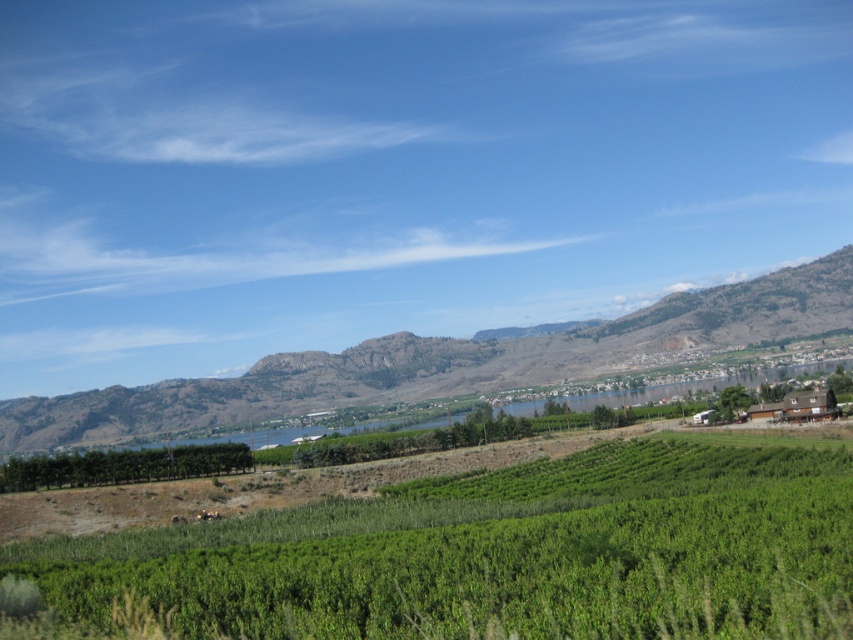
You are a landscape photographer planning to capture the entire scene in one shot. Given that your camera can only focus on objects within a 100m width, and the distance between the green leafy vineyard at center and the green grassy hill at left is 80 meters, will both objects fit within the camera frame?

The distance between the green leafy vineyard at center and the green grassy hill at left is 80 meters, which is within the camera frame limit of 100 meters. Therefore, both objects will fit within the camera frame.

Looking at this image, you are standing in the middle of the green leafy vineyard at center and want to climb to the top of the green grassy hill at left. Which direction should you head towards and why?

You should head towards the green grassy hill at left because the green leafy vineyard at center has a lesser height compared to the green grassy hill at left, meaning the hill is higher ground.